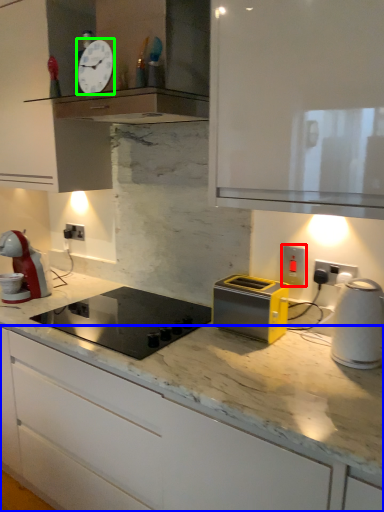
Question: Estimate the real-world distances between objects in this image. Which object is farther from electric outlet (highlighted by a red box), cabinetry (highlighted by a blue box) or clock (highlighted by a green box)?

Choices:
 (A) cabinetry
 (B) clock

Answer: (B)